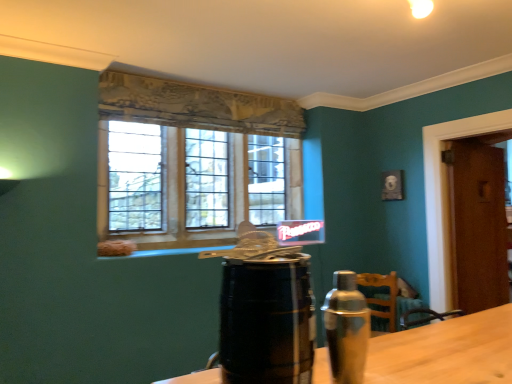
Question: Is clear glass window at center far from black wooden barrel at center?

Choices:
 (A) yes
 (B) no

Answer: (A)

Question: Is clear glass window at center not within black wooden barrel at center?

Choices:
 (A) no
 (B) yes

Answer: (B)

Question: Can you confirm if clear glass window at center is smaller than black wooden barrel at center?

Choices:
 (A) no
 (B) yes

Answer: (A)

Question: From the image's perspective, is clear glass window at center over black wooden barrel at center?

Choices:
 (A) yes
 (B) no

Answer: (A)

Question: Considering the relative sizes of clear glass window at center and black wooden barrel at center in the image provided, is clear glass window at center shorter than black wooden barrel at center?

Choices:
 (A) yes
 (B) no

Answer: (B)

Question: In terms of width, does clear glass window at center look wider or thinner when compared to silver metallic shaker at right?

Choices:
 (A) thin
 (B) wide

Answer: (B)

Question: From a real-world perspective, is clear glass window at center physically located above or below silver metallic shaker at right?

Choices:
 (A) above
 (B) below

Answer: (A)

Question: From their relative heights in the image, would you say clear glass window at center is taller or shorter than silver metallic shaker at right?

Choices:
 (A) tall
 (B) short

Answer: (A)

Question: In the image, is clear glass window at center positioned in front of or behind silver metallic shaker at right?

Choices:
 (A) behind
 (B) front

Answer: (A)

Question: In the image, is brown wooden door at right positioned in front of or behind black wooden barrel at center?

Choices:
 (A) front
 (B) behind

Answer: (B)

Question: Do you think brown wooden door at right is within black wooden barrel at center, or outside of it?

Choices:
 (A) outside
 (B) inside

Answer: (A)

Question: From the image's perspective, is brown wooden door at right above or below black wooden barrel at center?

Choices:
 (A) above
 (B) below

Answer: (B)

Question: Looking at the image, does brown wooden door at right seem bigger or smaller compared to black wooden barrel at center?

Choices:
 (A) big
 (B) small

Answer: (A)

Question: From the image's perspective, is black wooden barrel at center above or below clear glass window at center?

Choices:
 (A) below
 (B) above

Answer: (A)

Question: Is black wooden barrel at center inside or outside of clear glass window at center?

Choices:
 (A) outside
 (B) inside

Answer: (A)